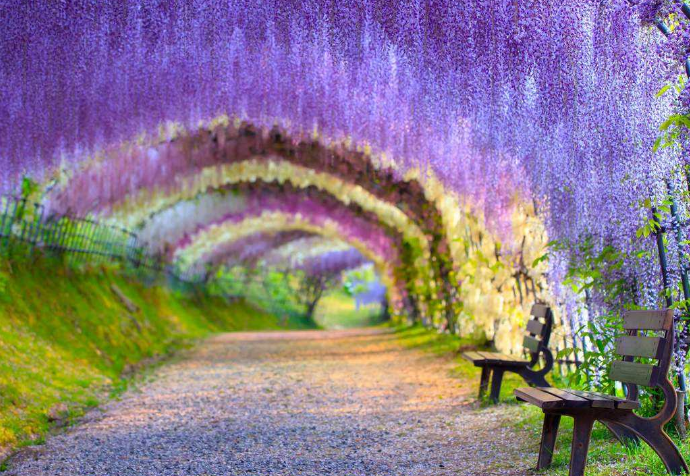
Identify the location of brown archway. The width and height of the screenshot is (690, 476). (379, 186).